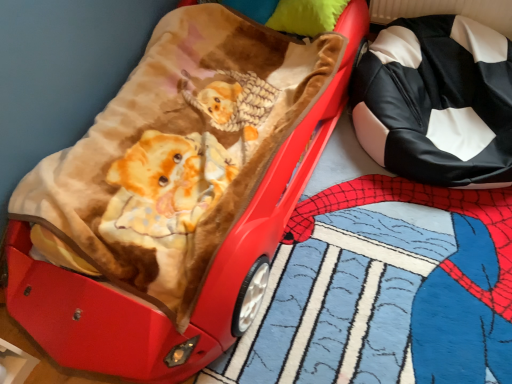
Question: Is velvet-like brown blanket at upper left wider or thinner than black/white leather pillow at right?

Choices:
 (A) thin
 (B) wide

Answer: (B)

Question: In the image, is velvet-like brown blanket at upper left on the left side or the right side of black/white leather pillow at right?

Choices:
 (A) right
 (B) left

Answer: (B)

Question: From the image's perspective, is velvet-like brown blanket at upper left above or below black/white leather pillow at right?

Choices:
 (A) below
 (B) above

Answer: (A)

Question: In terms of size, does black/white leather pillow at right appear bigger or smaller than velvet-like brown blanket at upper left?

Choices:
 (A) big
 (B) small

Answer: (B)

Question: Is black/white leather pillow at right to the left or to the right of velvet-like brown blanket at upper left in the image?

Choices:
 (A) left
 (B) right

Answer: (B)

Question: Is black/white leather pillow at right in front of or behind velvet-like brown blanket at upper left in the image?

Choices:
 (A) behind
 (B) front

Answer: (A)

Question: From their relative heights in the image, would you say black/white leather pillow at right is taller or shorter than velvet-like brown blanket at upper left?

Choices:
 (A) tall
 (B) short

Answer: (B)